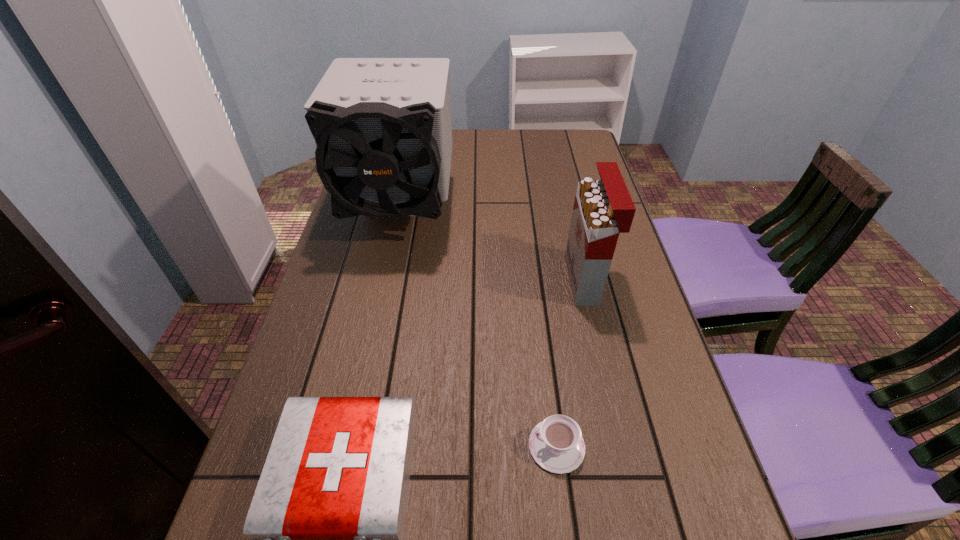
You are a GUI agent. You are given a task and a screenshot of the screen. Output one action in this format:
    pyautogui.click(x=<x>, y=<y>)
    Task: Click on the farthest object
    This screenshot has width=960, height=540.
    Given the screenshot: What is the action you would take?
    pyautogui.click(x=382, y=126)

Where is `fan`? fan is located at coordinates (382, 126).

The image size is (960, 540). I want to click on the second farthest object, so tap(603, 208).

Where is `the rightmost object`? the rightmost object is located at coordinates (603, 208).

This screenshot has height=540, width=960. In order to click on the second object from right to left in this screenshot , I will do `click(556, 444)`.

At what (x,y) coordinates should I click in order to perform the action: click on teacup. Please return your answer as a coordinate pair (x, y). The height and width of the screenshot is (540, 960). Looking at the image, I should click on (556, 444).

The image size is (960, 540). I want to click on vacant area located 0.230m on the right of the tallest object, so click(x=530, y=210).

The height and width of the screenshot is (540, 960). What are the coordinates of `vacant region located 0.330m with the lid open on the second farthest object` in the screenshot? It's located at (438, 280).

The image size is (960, 540). I want to click on free region located 0.370m with the lid open on the second farthest object, so click(422, 280).

Find the location of a particular element. free space located with the lid open on the second farthest object is located at coordinates (549, 280).